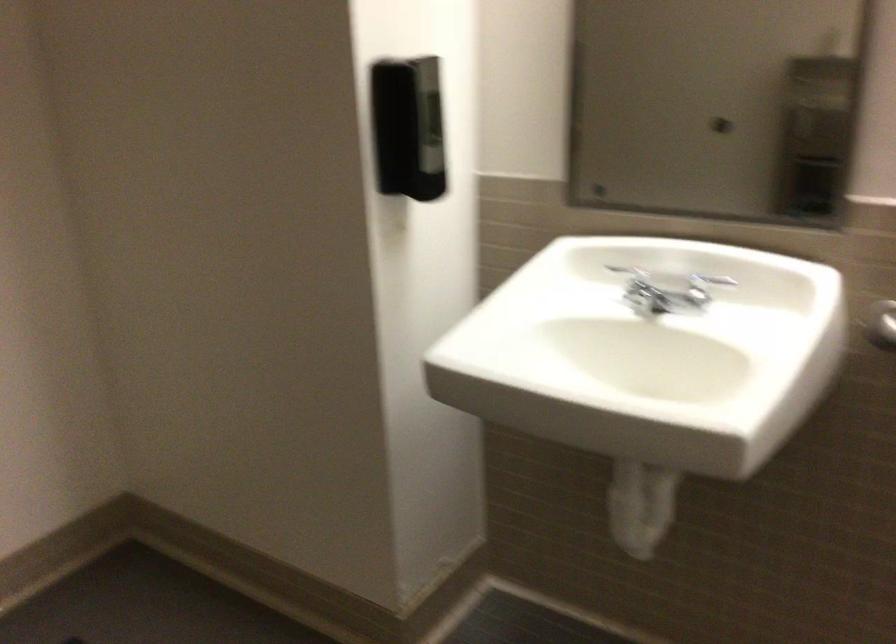
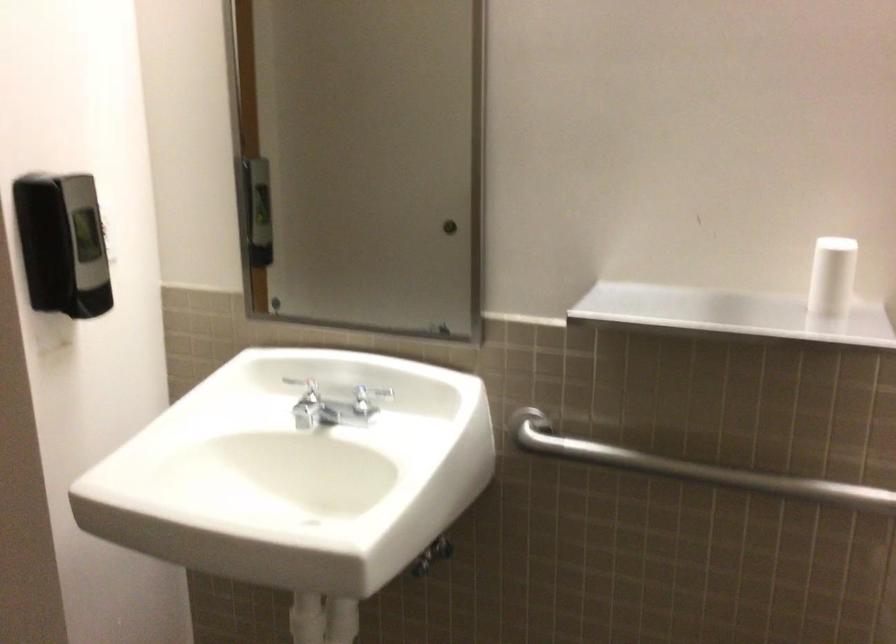
Question: The camera is either moving clockwise (left) or counter-clockwise (right) around the object. The first image is from the beginning of the video and the second image is from the end. Is the camera moving left or right when shooting the video?

Choices:
 (A) Left
 (B) Right

Answer: (A)